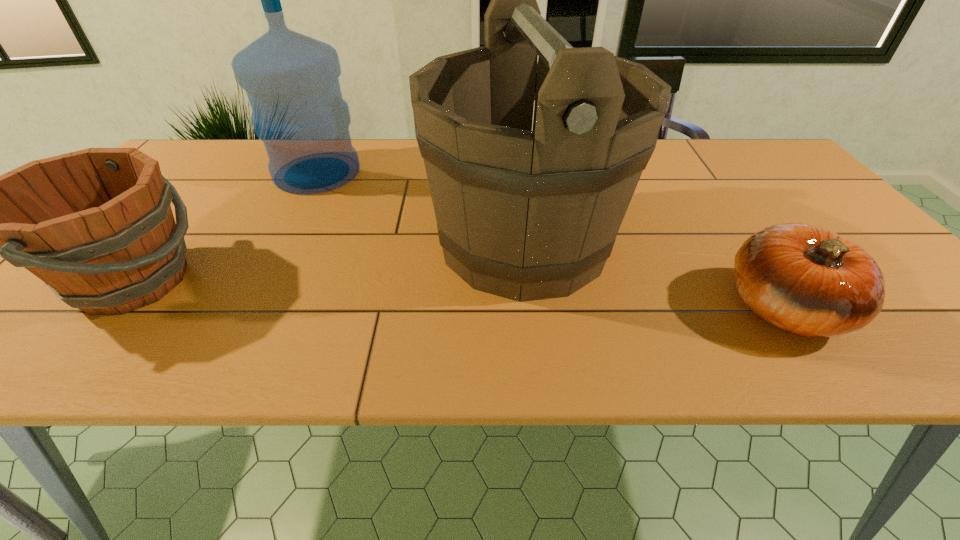
Identify the location of the second object from right to left. (536, 212).

Where is `the taller bucket`? The image size is (960, 540). the taller bucket is located at coordinates (536, 212).

Locate an element on the screen. water jug is located at coordinates (291, 80).

You are a GUI agent. You are given a task and a screenshot of the screen. Output one action in this format:
    pyautogui.click(x=<x>, y=<y>)
    Task: Click on the left bucket
    The width and height of the screenshot is (960, 540).
    Given the screenshot: What is the action you would take?
    pyautogui.click(x=96, y=226)

Identify the location of the third tallest object. (96, 226).

You are a GUI agent. You are given a task and a screenshot of the screen. Output one action in this format:
    pyautogui.click(x=<x>, y=<y>)
    Task: Click on the pumpkin
    This screenshot has width=960, height=540.
    Given the screenshot: What is the action you would take?
    pyautogui.click(x=807, y=280)

This screenshot has height=540, width=960. Identify the location of the shortest object. (807, 280).

In order to click on vacant region located on the right of the right bucket in this screenshot , I will do `click(692, 242)`.

At what (x,y) coordinates should I click in order to perform the action: click on free location located 0.280m on the right of the water jug. Please return your answer as a coordinate pair (x, y). The width and height of the screenshot is (960, 540). Looking at the image, I should click on (458, 172).

Identify the location of vacant area situated on the handle side of the left bucket. The width and height of the screenshot is (960, 540). click(x=316, y=281).